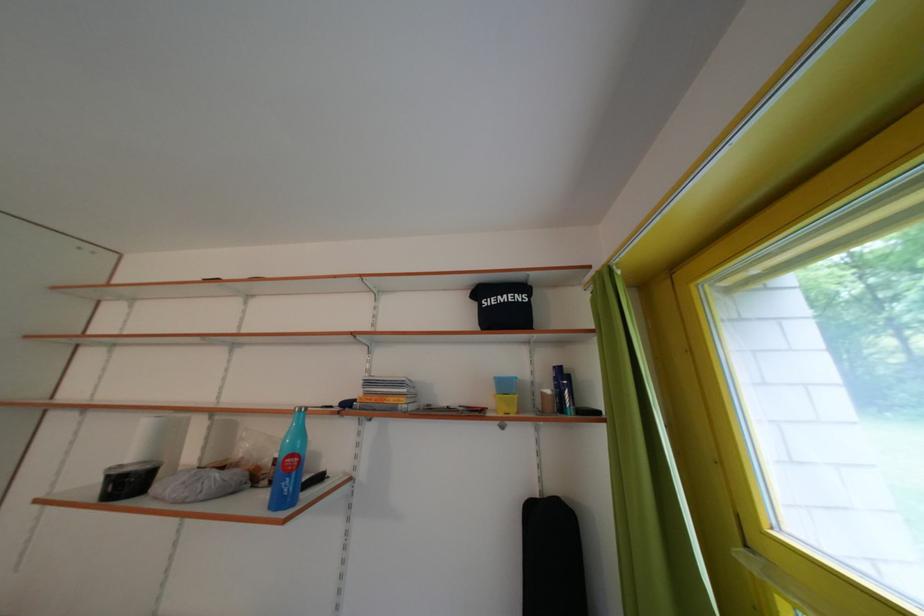
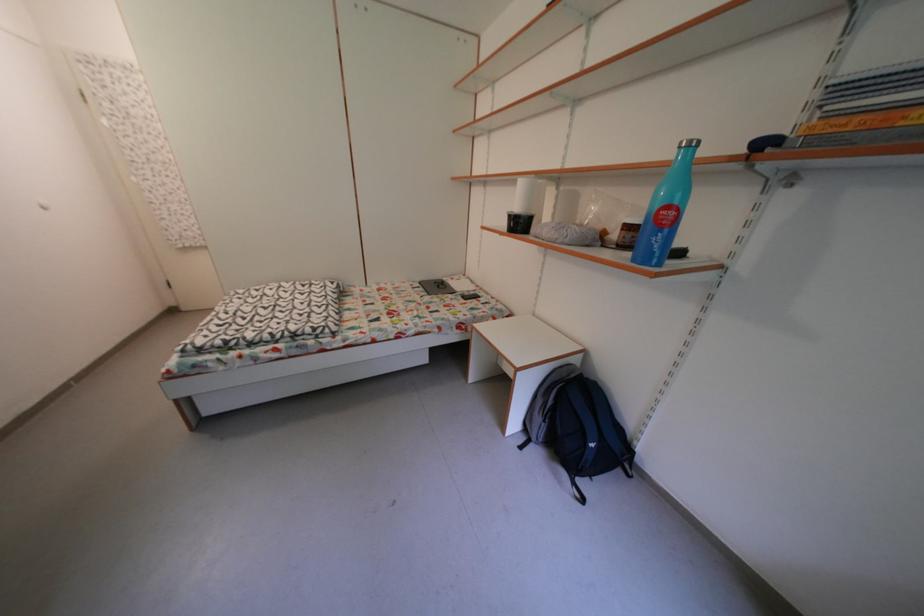
The images are taken continuously from a first-person perspective. In which direction is your viewpoint rotating?

The camera rotated toward left-down.